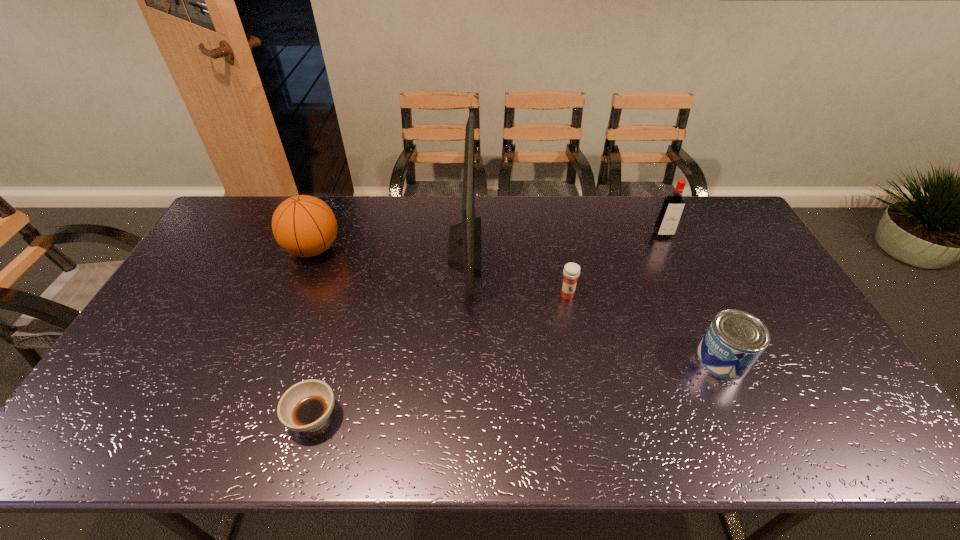
You are a GUI agent. You are given a task and a screenshot of the screen. Output one action in this format:
    pyautogui.click(x=<x>, y=<y>)
    Task: Click on the monitor
    This screenshot has width=960, height=540.
    Given the screenshot: What is the action you would take?
    pyautogui.click(x=464, y=250)

This screenshot has height=540, width=960. What are the coordinates of `the tallest object` in the screenshot? It's located at (464, 250).

I want to click on vodka, so click(x=669, y=216).

Identify the location of basketball. The image size is (960, 540). (305, 226).

This screenshot has height=540, width=960. What are the coordinates of `the second nearest object` in the screenshot? It's located at (735, 339).

You are a GUI agent. You are given a task and a screenshot of the screen. Output one action in this format:
    pyautogui.click(x=<x>, y=<y>)
    Task: Click on the fourth object from left to right
    The width and height of the screenshot is (960, 540).
    Given the screenshot: What is the action you would take?
    pyautogui.click(x=571, y=271)

I want to click on the shortest object, so click(x=306, y=406).

Where is `the fifth object from right to left`? The height and width of the screenshot is (540, 960). the fifth object from right to left is located at coordinates (306, 406).

Locate an element on the screen. The width and height of the screenshot is (960, 540). vacant region located 0.230m on the screen side of the fourth object from right to left is located at coordinates (549, 246).

Find the location of `free space located on the front and back of the vodka`. free space located on the front and back of the vodka is located at coordinates tap(704, 322).